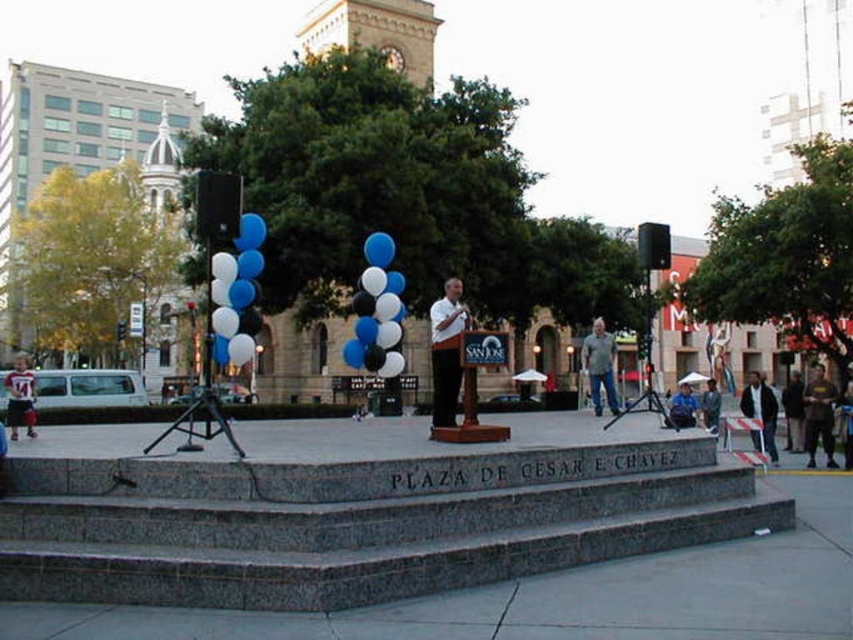
Is granite steps at center above blue fabric bag at center?

Yes, granite steps at center is above blue fabric bag at center.

Between granite steps at center and blue fabric bag at center, which one appears on the right side from the viewer's perspective?

Positioned to the right is blue fabric bag at center.

Between point (374, 512) and point (679, 397), which one is positioned behind?

The point (679, 397) is behind.

Find the location of a particular element. The image size is (853, 640). granite steps at center is located at coordinates (358, 522).

Who is higher up, white matte shirt at center or dark gray hoodie at lower right?

white matte shirt at center

Does white matte shirt at center appear on the left side of dark gray hoodie at lower right?

Correct, you'll find white matte shirt at center to the left of dark gray hoodie at lower right.

Between point (444, 376) and point (817, 388), which one is positioned behind?

Point (817, 388)

Image resolution: width=853 pixels, height=640 pixels. I want to click on white matte shirt at center, so click(445, 349).

Does dark gray hoodie at lower right have a greater height compared to striped jersey at lower left?

In fact, dark gray hoodie at lower right may be shorter than striped jersey at lower left.

Does point (815, 378) lie behind point (12, 404)?

That is True.

Measure the distance between point (817,404) and camera.

A distance of 42.76 meters exists between point (817,404) and camera.

Image resolution: width=853 pixels, height=640 pixels. I want to click on dark gray hoodie at lower right, so click(817, 416).